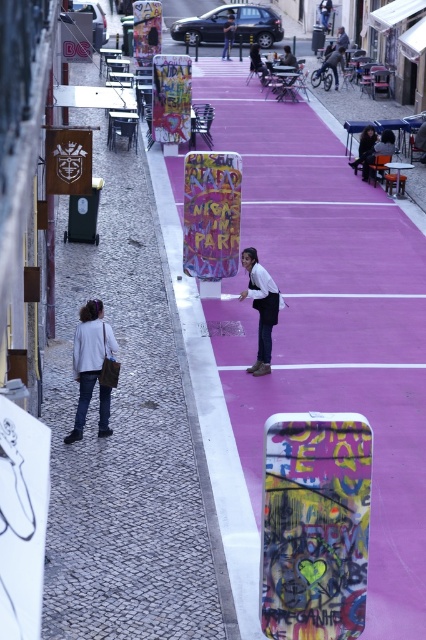
Question: Can you confirm if white matte jacket at lower left is smaller than white shirt at center?

Choices:
 (A) yes
 (B) no

Answer: (A)

Question: Which object is farther from the camera taking this photo?

Choices:
 (A) graffiti-covered skateboard at center
 (B) white matte jacket at lower left
 (C) dark blue jeans at center

Answer: (C)

Question: Which object is the farthest from the graffiti-covered skateboard at center?

Choices:
 (A) white shirt at center
 (B) matte black jacket at center

Answer: (B)

Question: Is the position of white matte jacket at lower left more distant than that of dark blue jeans at center?

Choices:
 (A) no
 (B) yes

Answer: (A)

Question: Estimate the real-world distances between objects in this image. Which object is farther from the graffiti-covered skateboard at center?

Choices:
 (A) white matte jacket at lower left
 (B) matte black jacket at center

Answer: (B)

Question: Does white matte jacket at lower left have a greater width compared to matte black jacket at center?

Choices:
 (A) yes
 (B) no

Answer: (A)